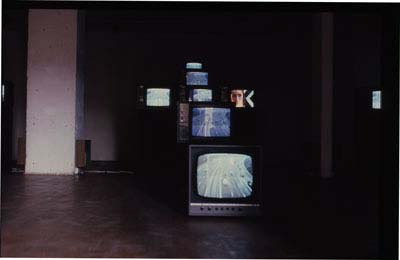
Where is `light`? The height and width of the screenshot is (260, 400). light is located at coordinates (23, 161).